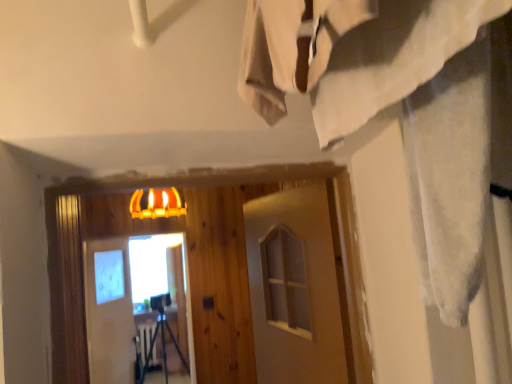
How much space does white matte barn door at center, which is the 2th barn door in right-to-left order, occupy horizontally?

6.41 inches.

Locate an element on the screen. This screenshot has height=384, width=512. white matte barn door at center, which is the 2th barn door in right-to-left order is located at coordinates (109, 311).

From the image's perspective, is white matte barn door at center, which ranks as the first barn door in back-to-front order, above or below matte glass screen door at center?

Based on their image positions, white matte barn door at center, which ranks as the first barn door in back-to-front order, is located beneath matte glass screen door at center.

Is white matte barn door at center, which is the 2th barn door in right-to-left order, closer to camera compared to matte glass screen door at center?

No, it is behind matte glass screen door at center.

Is white matte barn door at center, the 1th barn door in the left-to-right sequence, taller or shorter than matte glass screen door at center?

Considering their sizes, white matte barn door at center, the 1th barn door in the left-to-right sequence, has more height than matte glass screen door at center.

From a real-world perspective, who is located higher, white matte barn door at center, which ranks as the first barn door in back-to-front order, or matte glass screen door at center?

From a 3D spatial view, matte glass screen door at center is above.

Is yellow matte lamp at upper center looking in the opposite direction of matte glass screen door at center?

That's not correct — yellow matte lamp at upper center is not looking away from matte glass screen door at center.

Which object is more forward, yellow matte lamp at upper center or matte glass screen door at center?

yellow matte lamp at upper center.

Can you tell me how much yellow matte lamp at upper center and matte glass screen door at center differ in facing direction?

The angle between the facing direction of yellow matte lamp at upper center and the facing direction of matte glass screen door at center is 2.07 degrees.

Is yellow matte lamp at upper center outside of matte glass screen door at center?

Yes, yellow matte lamp at upper center is not within matte glass screen door at center.

Choose the correct answer: Is matte glass screen door at center inside white matte barn door at center, which ranks as the first barn door in back-to-front order, or outside it?

matte glass screen door at center lies outside white matte barn door at center, which ranks as the first barn door in back-to-front order.

Consider the image. Is matte glass screen door at center turned away from white matte barn door at center, the 1th barn door in the left-to-right sequence?

Yes.

From a real-world perspective, which object stands above the other?

matte glass screen door at center is physically above.

Considering the sizes of matte glass screen door at center and white matte barn door at center, the 1th barn door in the left-to-right sequence, in the image, is matte glass screen door at center taller or shorter than white matte barn door at center, the 1th barn door in the left-to-right sequence,?

Clearly, matte glass screen door at center is shorter compared to white matte barn door at center, the 1th barn door in the left-to-right sequence.

Measure the distance between white matte barn door at center, the 1th barn door in the left-to-right sequence, and yellow matte lamp at upper center.

1.04 meters.

Which is more to the right, white matte barn door at center, which is the 2th barn door in right-to-left order, or yellow matte lamp at upper center?

From the viewer's perspective, yellow matte lamp at upper center appears more on the right side.

Between white matte barn door at center, the 1th barn door in the left-to-right sequence, and yellow matte lamp at upper center, which one has larger size?

white matte barn door at center, the 1th barn door in the left-to-right sequence.

Who is taller, white matte barn door at center, which ranks as the first barn door in back-to-front order, or yellow matte lamp at upper center?

With more height is white matte barn door at center, which ranks as the first barn door in back-to-front order.

Is yellow matte lamp at upper center wider than white matte barn door at center, positioned as the 1th barn door in front-to-back order?

Yes, yellow matte lamp at upper center is wider than white matte barn door at center, positioned as the 1th barn door in front-to-back order.

Considering the positions of objects yellow matte lamp at upper center and white matte barn door at center, which appears as the second barn door when viewed from the back, in the image provided, who is more to the right, yellow matte lamp at upper center or white matte barn door at center, which appears as the second barn door when viewed from the back,?

white matte barn door at center, which appears as the second barn door when viewed from the back, is more to the right.

Is yellow matte lamp at upper center inside the boundaries of white matte barn door at center, which appears as the second barn door when viewed from the back, or outside?

yellow matte lamp at upper center lies outside white matte barn door at center, which appears as the second barn door when viewed from the back.

Can you confirm if white matte barn door at center, the 2th barn door viewed from the front, is positioned to the right of white matte barn door at center, positioned as the 1th barn door in front-to-back order?

No, white matte barn door at center, the 2th barn door viewed from the front, is not to the right of white matte barn door at center, positioned as the 1th barn door in front-to-back order.

Choose the correct answer: Is white matte barn door at center, which ranks as the first barn door in back-to-front order, inside white matte barn door at center, marked as the 2th barn door in a left-to-right arrangement, or outside it?

white matte barn door at center, which ranks as the first barn door in back-to-front order, cannot be found inside white matte barn door at center, marked as the 2th barn door in a left-to-right arrangement.

Where is `barn door located on the right of white matte barn door at center, the 1th barn door in the left-to-right sequence`? The image size is (512, 384). barn door located on the right of white matte barn door at center, the 1th barn door in the left-to-right sequence is located at coordinates click(297, 288).

Is point (141, 217) positioned after point (100, 323)?

No, (141, 217) is closer to viewer.

How many degrees apart are the facing directions of yellow matte lamp at upper center and white matte barn door at center, the 1th barn door in the left-to-right sequence?

yellow matte lamp at upper center and white matte barn door at center, the 1th barn door in the left-to-right sequence, are facing 68.1 degrees away from each other.

Between yellow matte lamp at upper center and white matte barn door at center, which is the 2th barn door in right-to-left order, which one has more height?

With more height is white matte barn door at center, which is the 2th barn door in right-to-left order.

Is yellow matte lamp at upper center outside of white matte barn door at center, the 1th barn door in the left-to-right sequence?

Absolutely, yellow matte lamp at upper center is external to white matte barn door at center, the 1th barn door in the left-to-right sequence.

At what (x,y) coordinates should I click in order to perform the action: click on screen door that appears above the white matte barn door at center, the 1th barn door in the left-to-right sequence (from a real-world perspective). Please return your answer as a coordinate pair (x, y). The height and width of the screenshot is (384, 512). Looking at the image, I should click on (122, 301).

At what (x,y) coordinates should I click in order to perform the action: click on lamp in front of the matte glass screen door at center. Please return your answer as a coordinate pair (x, y). This screenshot has width=512, height=384. Looking at the image, I should click on (157, 204).

When comparing their distances from white matte barn door at center, which appears as the second barn door when viewed from the back, does matte glass screen door at center or yellow matte lamp at upper center seem closer?

yellow matte lamp at upper center lies closer to white matte barn door at center, which appears as the second barn door when viewed from the back, than the other object.

Based on their spatial positions, is matte glass screen door at center or white matte barn door at center, which is counted as the first barn door, starting from the right, further from white matte barn door at center, the 1th barn door in the left-to-right sequence?

white matte barn door at center, which is counted as the first barn door, starting from the right, lies further to white matte barn door at center, the 1th barn door in the left-to-right sequence, than the other object.

Which object lies further to the anchor point white matte barn door at center, which appears as the second barn door when viewed from the back, white matte barn door at center, the 1th barn door in the left-to-right sequence, or matte glass screen door at center?

Based on the image, matte glass screen door at center appears to be further to white matte barn door at center, which appears as the second barn door when viewed from the back.

Based on their spatial positions, is yellow matte lamp at upper center or white matte barn door at center, which appears as the second barn door when viewed from the back, further from white matte barn door at center, the 2th barn door viewed from the front?

white matte barn door at center, which appears as the second barn door when viewed from the back.

Looking at the image, which one is located further to white matte barn door at center, marked as the 2th barn door in a left-to-right arrangement, yellow matte lamp at upper center or white matte barn door at center, the 2th barn door viewed from the front?

Based on the image, white matte barn door at center, the 2th barn door viewed from the front, appears to be further to white matte barn door at center, marked as the 2th barn door in a left-to-right arrangement.

Looking at this image, from the image, which object appears to be nearer to white matte barn door at center, the 2th barn door viewed from the front, matte glass screen door at center or yellow matte lamp at upper center?

matte glass screen door at center is positioned closer to the anchor white matte barn door at center, the 2th barn door viewed from the front.

Which object lies nearer to the anchor point yellow matte lamp at upper center, white matte barn door at center, the 2th barn door viewed from the front, or white matte barn door at center, which is counted as the first barn door, starting from the right?

white matte barn door at center, the 2th barn door viewed from the front, is closer to yellow matte lamp at upper center.

From the image, which object appears to be nearer to yellow matte lamp at upper center, white matte barn door at center, marked as the 2th barn door in a left-to-right arrangement, or white matte barn door at center, which is the 2th barn door in right-to-left order?

→ white matte barn door at center, which is the 2th barn door in right-to-left order, is closer to yellow matte lamp at upper center.

Where is `lamp positioned between white matte barn door at center, marked as the 2th barn door in a left-to-right arrangement, and white matte barn door at center, the 2th barn door viewed from the front, from near to far`? This screenshot has height=384, width=512. lamp positioned between white matte barn door at center, marked as the 2th barn door in a left-to-right arrangement, and white matte barn door at center, the 2th barn door viewed from the front, from near to far is located at coordinates [157, 204].

At what (x,y) coordinates should I click in order to perform the action: click on screen door between white matte barn door at center, marked as the 2th barn door in a left-to-right arrangement, and white matte barn door at center, which is the 2th barn door in right-to-left order, from front to back. Please return your answer as a coordinate pair (x, y). Looking at the image, I should click on (122, 301).

This screenshot has height=384, width=512. Identify the location of screen door between yellow matte lamp at upper center and white matte barn door at center, which is the 2th barn door in right-to-left order, in the up-down direction. (122, 301).

Identify the location of lamp located between white matte barn door at center, marked as the 2th barn door in a left-to-right arrangement, and matte glass screen door at center in the depth direction. (157, 204).